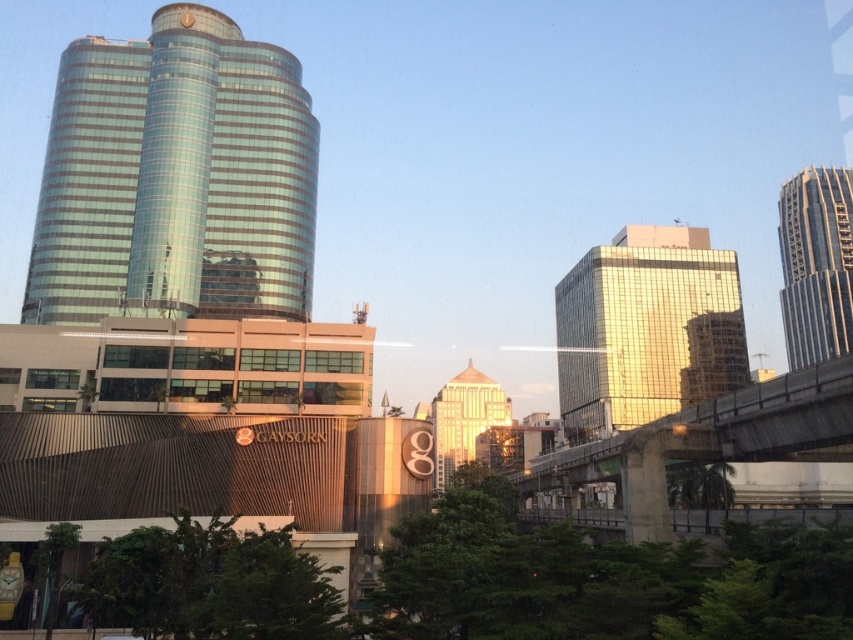
Does shiny glass tower at upper left have a smaller size compared to concrete bridge at right?

Incorrect, shiny glass tower at upper left is not smaller in size than concrete bridge at right.

Is shiny glass tower at upper left positioned at the back of concrete bridge at right?

Yes.

Is point (146, 305) closer to viewer compared to point (817, 429)?

No, it is behind (817, 429).

Locate an element on the screen. The image size is (853, 640). shiny glass tower at upper left is located at coordinates (175, 177).

Does glossy glass building at center have a greater height compared to gold glass tower at center?

Yes, glossy glass building at center is taller than gold glass tower at center.

Can you confirm if glossy glass building at center is positioned to the left of gold glass tower at center?

In fact, glossy glass building at center is to the right of gold glass tower at center.

Is point (637, 266) positioned before point (450, 412)?

That is True.

I want to click on glossy glass building at center, so click(x=646, y=330).

Can you confirm if glossy glass building at center is positioned above concrete bridge at right?

Correct, glossy glass building at center is located above concrete bridge at right.

Measure the distance between point (611,304) and camera.

Point (611,304) and camera are 142.92 meters apart from each other.

Locate an element on the screen. glossy glass building at center is located at coordinates (646, 330).